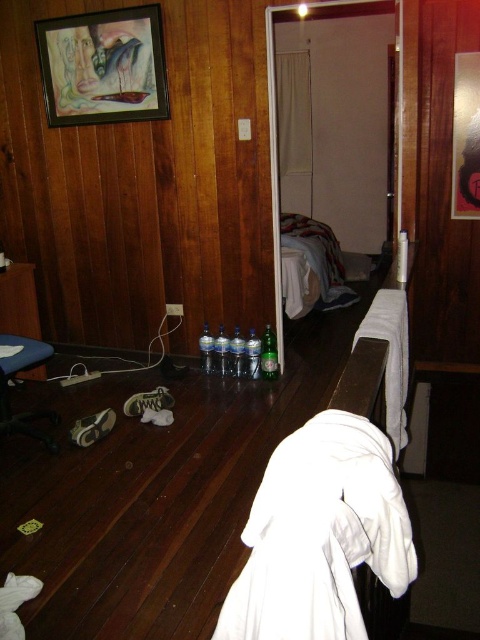
You are standing in the room and want to place a large bookshelf between the white soft robe at center and the matte black picture frame at upper left. Is there enough space to fit the bookshelf, which is 8 feet wide?

The white soft robe at center and the matte black picture frame at upper left are 9.56 feet apart, so yes, the bookshelf can fit between them as there is sufficient space.

You are a delivery person carrying a large package that requires a clear path to the white fabric bed at center. The white soft robe at center is in the way. Can you navigate around it without moving the robe?

The distance between the white soft robe at center and the white fabric bed at center is 3.45 meters. Since the robe is not blocking the path and there is sufficient space, you can navigate around it without moving the robe.

Looking at this image, you are standing in the room depicted in the scene. There is a matte black picture frame at upper left. Can you see the point at coordinate [103,67] from your current position?

The matte black picture frame at upper left is represented by point [103,67], so yes, you can see the point at coordinate [103,67] from your current position because it corresponds to the location of the matte black picture frame at upper left.